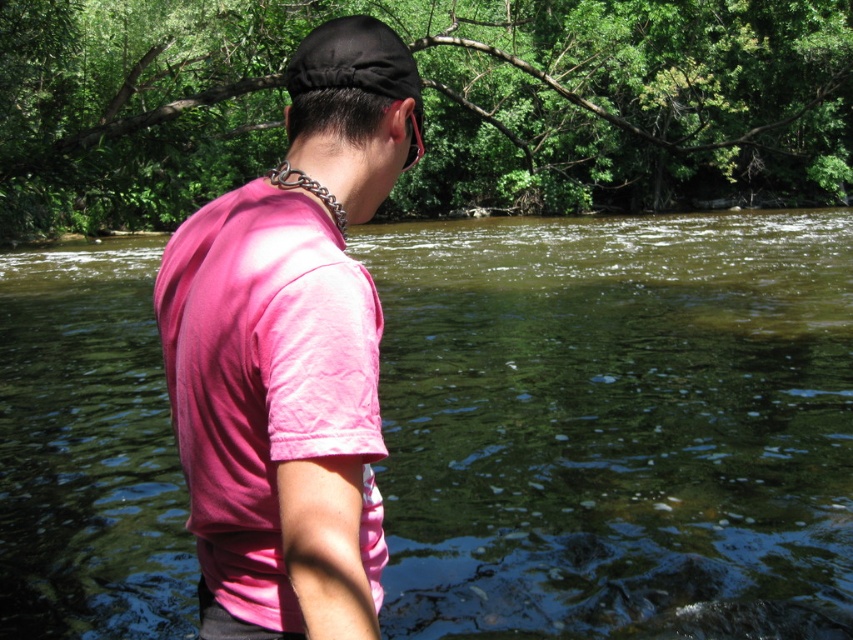
You are a photographer wanting to capture the pink cotton shirt at center and the clear water at creek center in the same frame. Given that your camera has a maximum focus range of 30 feet, will you be able to focus on both subjects simultaneously?

The clear water at creek center and pink cotton shirt at center are 33.23 feet apart from each other, which exceeds the camera maximum focus range of 30 feet. Therefore, you cannot focus on both subjects simultaneously.

You are trying to locate the clear water at creek center in the scene. According to the coordinates provided, where exactly is it positioned?

The clear water at creek center is located at point coordinates of 0.664 on the x axis and 0.723 on the y axis.

You are planning to cross the river at the location shown in the image. You have a small boat that can carry items up to the width of the pink cotton shirt at center. Can your boat safely navigate the width of the clear water at creek center without getting stuck?

The clear water at creek center is wider than the pink cotton shirt at center. Since your boat can only carry items up to the width of the pink cotton shirt at center, it should be able to safely navigate the width of the clear water at creek center without getting stuck as the boat itself is small and the creek is wider.